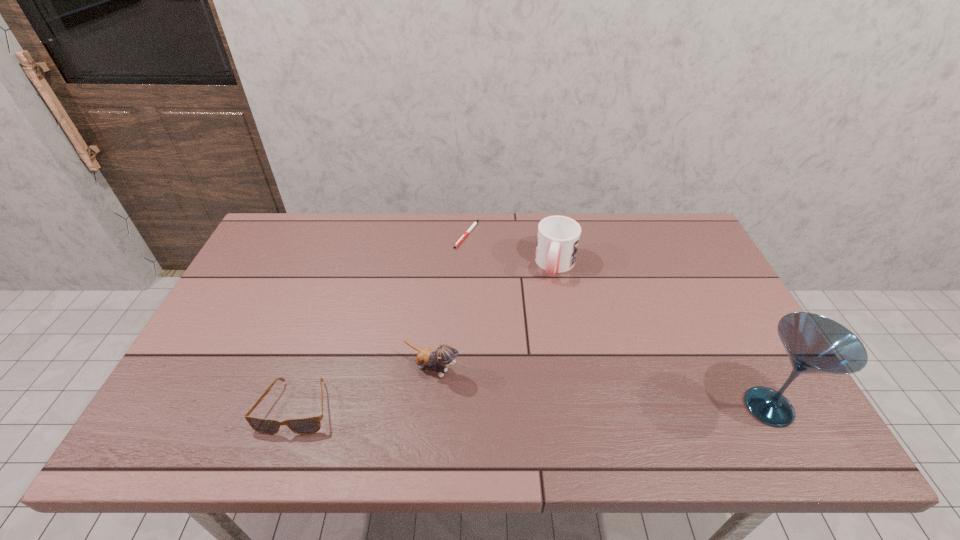
Find the location of a particular element. This screenshot has height=540, width=960. free spot between the fourth object from left to right and the third shortest object is located at coordinates (494, 317).

You are a GUI agent. You are given a task and a screenshot of the screen. Output one action in this format:
    pyautogui.click(x=<x>, y=<y>)
    Task: Click on the free space between the tallest object and the leftmost object
    The image size is (960, 540).
    Given the screenshot: What is the action you would take?
    pyautogui.click(x=533, y=407)

Where is `free spot between the second object from right to left and the shortest object`? The height and width of the screenshot is (540, 960). free spot between the second object from right to left and the shortest object is located at coordinates [x=512, y=249].

Identify the location of unoccupied position between the mug and the shortest object. Image resolution: width=960 pixels, height=540 pixels. (512, 249).

Find the location of `vacant region between the pen and the mug`. vacant region between the pen and the mug is located at coordinates (512, 249).

Where is `vacant point located between the kitten and the mug`? This screenshot has width=960, height=540. vacant point located between the kitten and the mug is located at coordinates (494, 317).

This screenshot has height=540, width=960. What are the coordinates of `empty space between the fourth tallest object and the second object from right to left` in the screenshot? It's located at (426, 336).

Locate an element on the screen. Image resolution: width=960 pixels, height=540 pixels. vacant area between the second object from right to left and the shortest object is located at coordinates (512, 249).

You are a GUI agent. You are given a task and a screenshot of the screen. Output one action in this format:
    pyautogui.click(x=<x>, y=<y>)
    Task: Click on the vacant space that's between the kitten and the leftmost object
    This screenshot has width=960, height=540.
    Given the screenshot: What is the action you would take?
    pyautogui.click(x=364, y=388)

The width and height of the screenshot is (960, 540). I want to click on vacant region between the second object from right to left and the martini, so (662, 336).